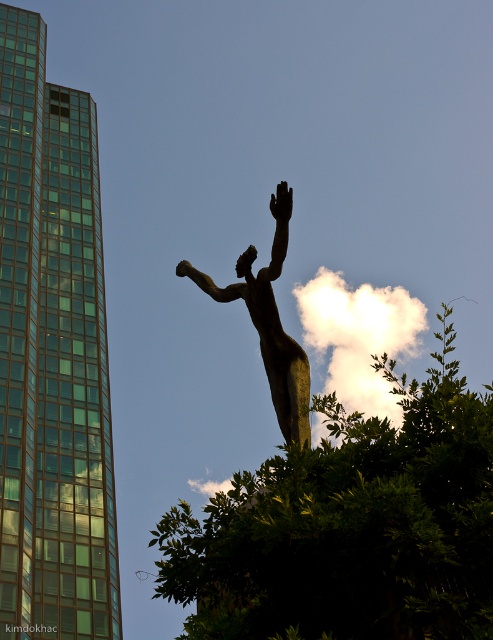
You are an architect planning to install a new light pole between the green leafy tree at center and the bronze statue at center. Based on the scene, where should the light pole be placed relative to the two objects?

The light pole should be placed above the green leafy tree at center and below the bronze statue at center since the green leafy tree at center is located below the bronze statue at center.

You are a city planner reviewing a blueprint of the urban area shown. The blueprint uses a coordinate system where the bottom left corner is the origin point. The modern glass building is on the left side of the image. Where is the bronze statue at center located in terms of coordinates?

The bronze statue at center is located at coordinates approximately 0.531 on the x axis and 0.552 on the y axis.

You are an urban planner assessing the space between the green leafy tree at center and the bronze statue at center. Can you determine if there is enough space for a 2 meter wide walkway between them?

The green leafy tree at center might be wider than bronze statue at center, so the space between them may not be sufficient for a 2 meter wide walkway. Further measurements are needed to confirm.